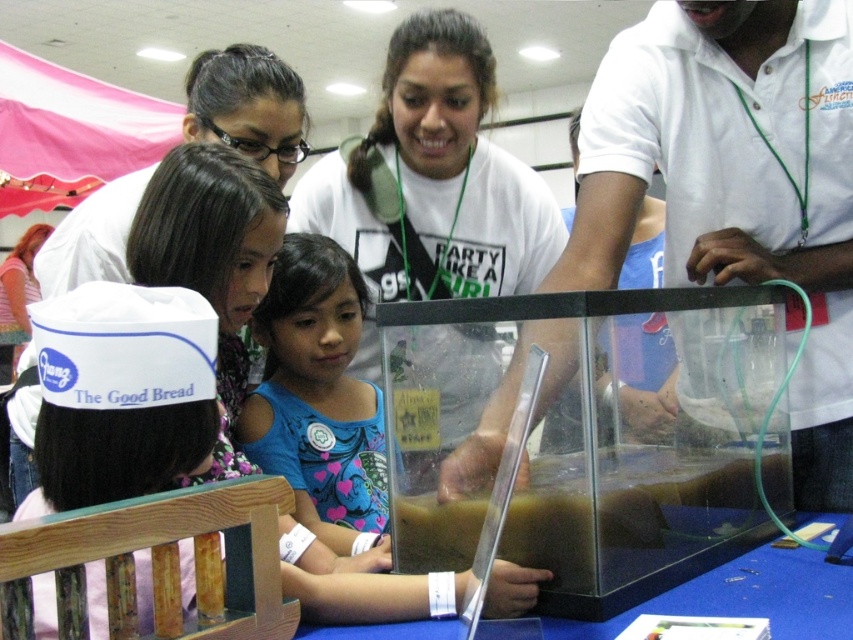
Question: Which point is farther to the camera?

Choices:
 (A) (688, 205)
 (B) (798, 620)

Answer: (A)

Question: Is white shirt at upper center thinner than blue cotton shirt at center?

Choices:
 (A) yes
 (B) no

Answer: (B)

Question: Can you confirm if white shirt at upper center is positioned below white t-shirt at center?

Choices:
 (A) yes
 (B) no

Answer: (A)

Question: Which of the following is the farthest from the observer?

Choices:
 (A) (801, 404)
 (B) (300, 387)

Answer: (B)

Question: Where is white shirt at upper center located in relation to white paper hat at upper left in the image?

Choices:
 (A) left
 (B) right

Answer: (B)

Question: Among these objects, which one is nearest to the camera?

Choices:
 (A) transparent plastic table at lower center
 (B) white shirt at upper center
 (C) transparent glass tank at center

Answer: (A)